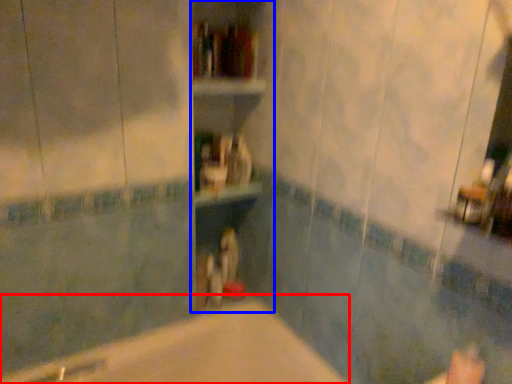
Question: Which object is closer to the camera taking this photo, bathtub (highlighted by a red box) or bookshelf (highlighted by a blue box)?

Choices:
 (A) bathtub
 (B) bookshelf

Answer: (A)